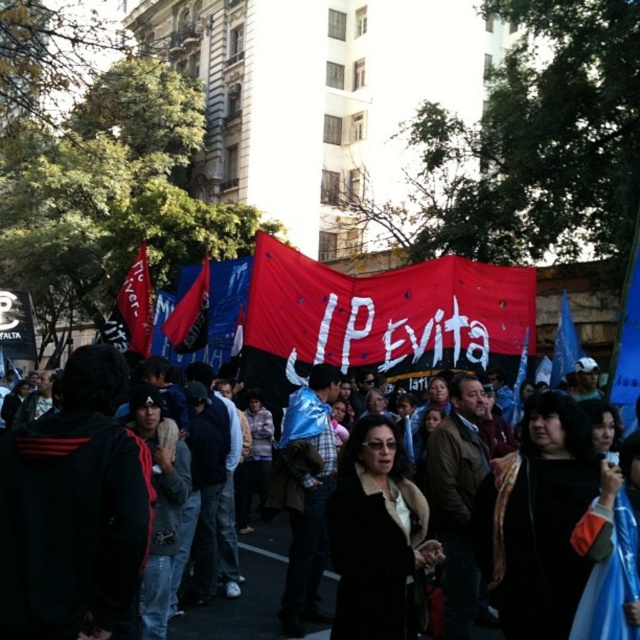
Does red fabric flag at left have a greater height compared to blue fabric flag at center?

Yes.

Can you confirm if red fabric flag at left is positioned to the right of blue fabric flag at center?

In fact, red fabric flag at left is to the left of blue fabric flag at center.

Is point (140, 305) positioned before point (573, 339)?

That is False.

This screenshot has height=640, width=640. In order to click on red fabric flag at left in this screenshot , I will do `click(138, 304)`.

Is red fabric flag at center wider than blue fabric flag at center?

Yes.

Can you confirm if red fabric flag at center is shorter than blue fabric flag at center?

In fact, red fabric flag at center may be taller than blue fabric flag at center.

Which is behind, point (205, 289) or point (573, 337)?

Positioned behind is point (205, 289).

Identify the location of red fabric flag at center. The height and width of the screenshot is (640, 640). (189, 314).

Who is more distant from viewer, (204,320) or (138,332)?

The point (138,332) is behind.

Looking at this image, is red fabric flag at center below red fabric flag at left?

Yes, red fabric flag at center is below red fabric flag at left.

What do you see at coordinates (189, 314) in the screenshot?
I see `red fabric flag at center` at bounding box center [189, 314].

At what (x,y) coordinates should I click in order to perform the action: click on red fabric flag at center. Please return your answer as a coordinate pair (x, y). The height and width of the screenshot is (640, 640). Looking at the image, I should click on (189, 314).